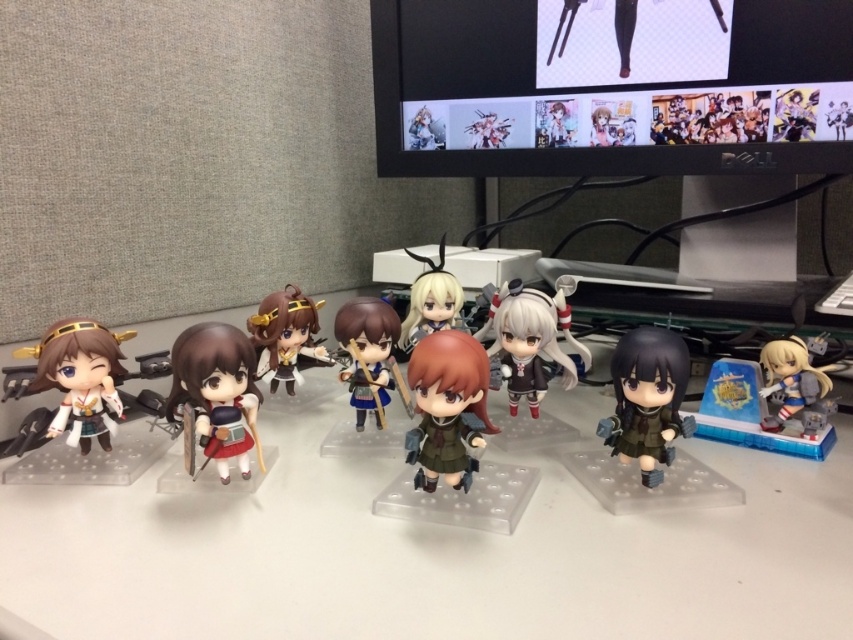
Is matte red skirt at center below matte black figure at lower right?

Yes, matte red skirt at center is below matte black figure at lower right.

Between point (207, 339) and point (631, 344), which one is positioned in front?

Point (207, 339) is more forward.

The image size is (853, 640). Identify the location of matte red skirt at center. (215, 396).

Is point (512, 346) positioned before point (370, 348)?

That is False.

Is white matte doll at center to the left of matte blue fabric doll at center from the viewer's perspective?

In fact, white matte doll at center is to the right of matte blue fabric doll at center.

The width and height of the screenshot is (853, 640). What are the coordinates of `white matte doll at center` in the screenshot? It's located at (531, 339).

Is clear plastic table at center below matte white figurine at left?

Correct, clear plastic table at center is located below matte white figurine at left.

Which is more to the right, clear plastic table at center or matte white figurine at left?

clear plastic table at center

Is point (550, 554) farther from viewer compared to point (86, 349)?

No, (550, 554) is closer to viewer.

Locate an element on the screen. clear plastic table at center is located at coordinates (433, 548).